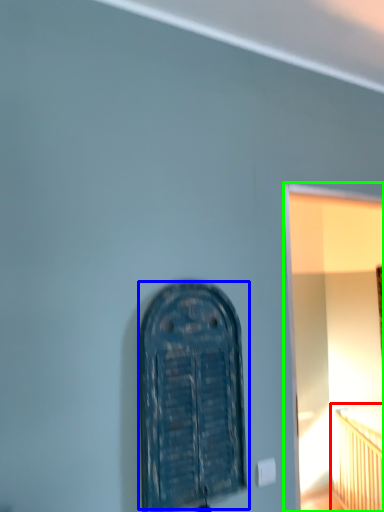
Question: Based on their relative distances, which object is farther from bed (highlighted by a red box)? Choose from door (highlighted by a blue box) and window frame (highlighted by a green box).

Choices:
 (A) door
 (B) window frame

Answer: (A)